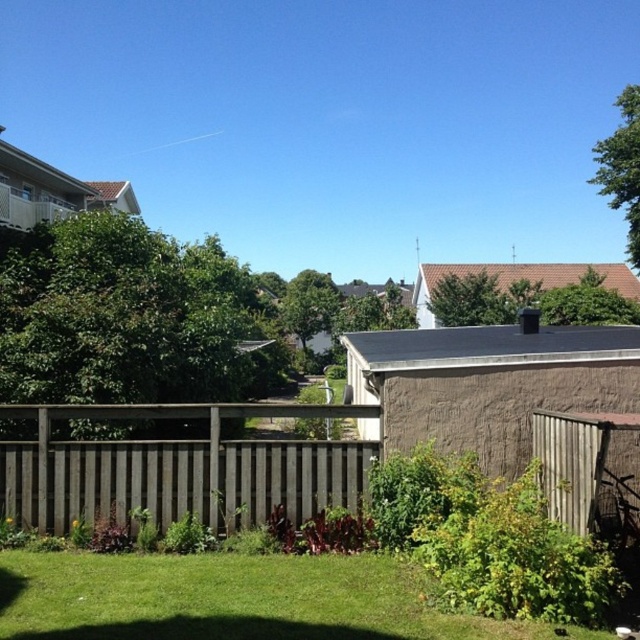
Who is higher up, green grass at lower center or weathered wood fence at center?

weathered wood fence at center is higher up.

In the scene shown: Who is positioned more to the right, green grass at lower center or weathered wood fence at center?

green grass at lower center

You are a GUI agent. You are given a task and a screenshot of the screen. Output one action in this format:
    pyautogui.click(x=<x>, y=<y>)
    Task: Click on the green grass at lower center
    
    Given the screenshot: What is the action you would take?
    pyautogui.click(x=228, y=598)

The image size is (640, 640). Identify the location of green grass at lower center. (228, 598).